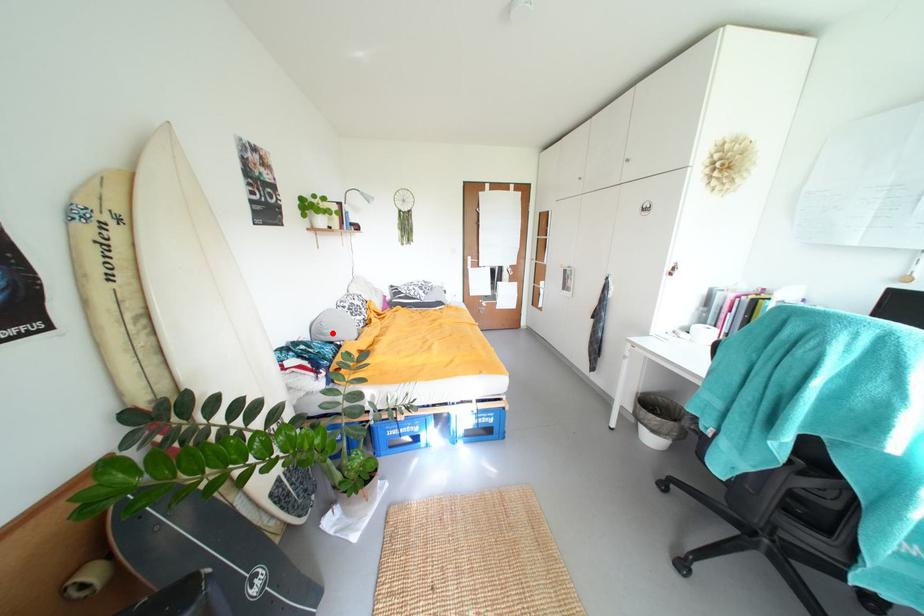
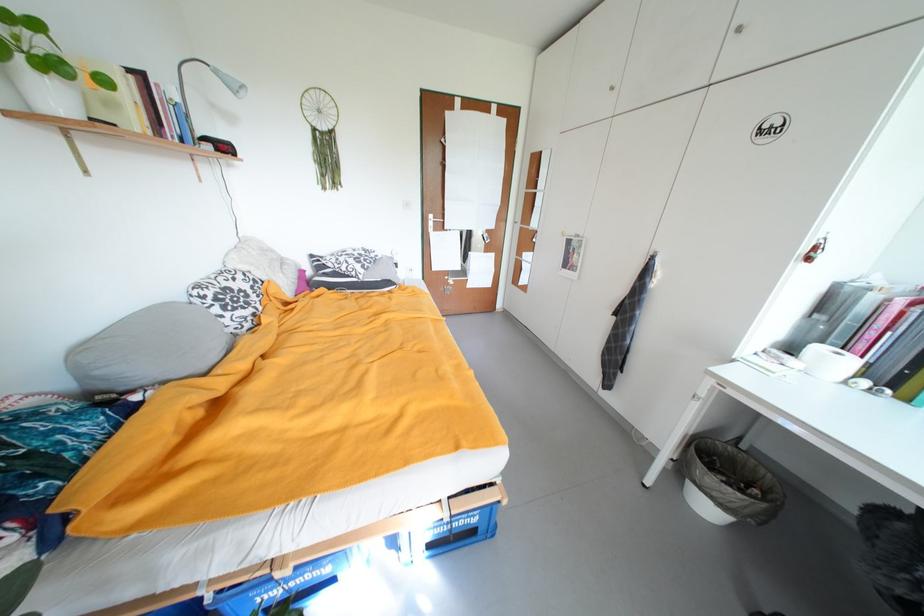
Where in the second image is the point corresponding to the highlighted location from the first image?

(105, 374)